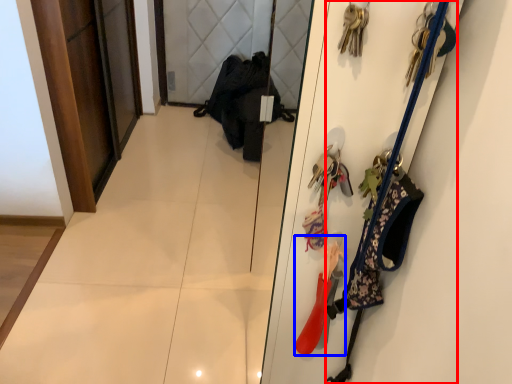
Question: Which of the following is the closest to the observer, accessory (highlighted by a red box) or accessory (highlighted by a blue box)?

Choices:
 (A) accessory
 (B) accessory

Answer: (A)